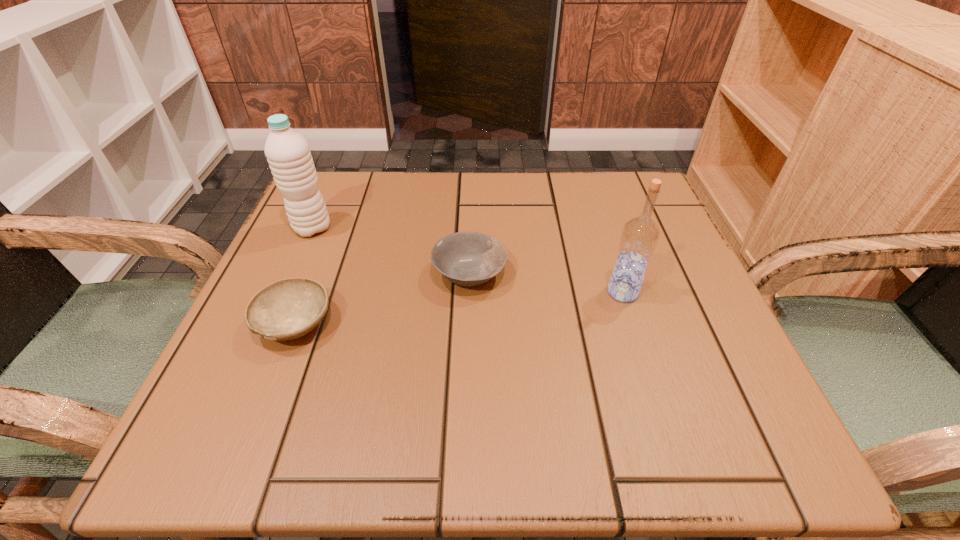
Where is `water bottle`? water bottle is located at coordinates (289, 157).

Identify the location of the rightmost object. Image resolution: width=960 pixels, height=540 pixels. (640, 235).

Find the location of a particular element. This screenshot has width=960, height=540. the right bowl is located at coordinates (468, 259).

Where is `the left bowl`? the left bowl is located at coordinates (287, 309).

Identify the location of free space located 0.160m on the front of the farthest object. The image size is (960, 540). 281,299.

The height and width of the screenshot is (540, 960). Identify the location of vacant space located 0.070m on the left of the vodka. (566, 292).

Image resolution: width=960 pixels, height=540 pixels. In order to click on free space located on the left of the third object from left to right in this screenshot , I will do [284, 274].

This screenshot has width=960, height=540. Identify the location of free space located on the right of the left bowl. (474, 324).

The height and width of the screenshot is (540, 960). I want to click on object that is at the far edge, so click(x=289, y=157).

Locate an element on the screen. Image resolution: width=960 pixels, height=540 pixels. water bottle that is at the left edge is located at coordinates (289, 157).